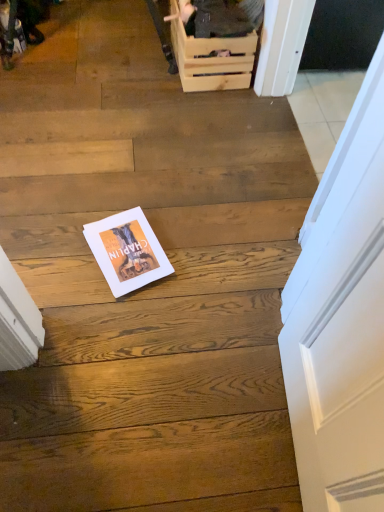
Question: From the image's perspective, is white paper magazine at center located above wooden crate at upper center?

Choices:
 (A) yes
 (B) no

Answer: (B)

Question: From the image's perspective, is white paper magazine at center located beneath wooden crate at upper center?

Choices:
 (A) no
 (B) yes

Answer: (B)

Question: Considering the relative sizes of white paper magazine at center and wooden crate at upper center in the image provided, is white paper magazine at center bigger than wooden crate at upper center?

Choices:
 (A) no
 (B) yes

Answer: (A)

Question: Would you say white paper magazine at center is outside wooden crate at upper center?

Choices:
 (A) no
 (B) yes

Answer: (B)

Question: Is white paper magazine at center smaller than wooden crate at upper center?

Choices:
 (A) no
 (B) yes

Answer: (B)

Question: From a real-world perspective, is wooden crate at upper center physically located above or below wooden crate at upper center?

Choices:
 (A) below
 (B) above

Answer: (B)

Question: Based on their sizes in the image, would you say wooden crate at upper center is bigger or smaller than wooden crate at upper center?

Choices:
 (A) small
 (B) big

Answer: (B)

Question: Is wooden crate at upper center in front of or behind wooden crate at upper center in the image?

Choices:
 (A) behind
 (B) front

Answer: (B)

Question: Looking at their shapes, would you say wooden crate at upper center is wider or thinner than wooden crate at upper center?

Choices:
 (A) thin
 (B) wide

Answer: (B)

Question: Is point (203, 54) positioned closer to the camera than point (94, 228)?

Choices:
 (A) farther
 (B) closer

Answer: (A)

Question: From the image's perspective, relative to white paper magazine at center, is wooden crate at upper center above or below?

Choices:
 (A) above
 (B) below

Answer: (A)

Question: Is wooden crate at upper center taller or shorter than white paper magazine at center?

Choices:
 (A) tall
 (B) short

Answer: (A)

Question: Relative to white paper magazine at center, is wooden crate at upper center in front or behind?

Choices:
 (A) front
 (B) behind

Answer: (B)

Question: In terms of size, does wooden crate at upper center appear bigger or smaller than wooden crate at upper center?

Choices:
 (A) big
 (B) small

Answer: (B)

Question: Considering their positions, is wooden crate at upper center located in front of or behind wooden crate at upper center?

Choices:
 (A) front
 (B) behind

Answer: (B)